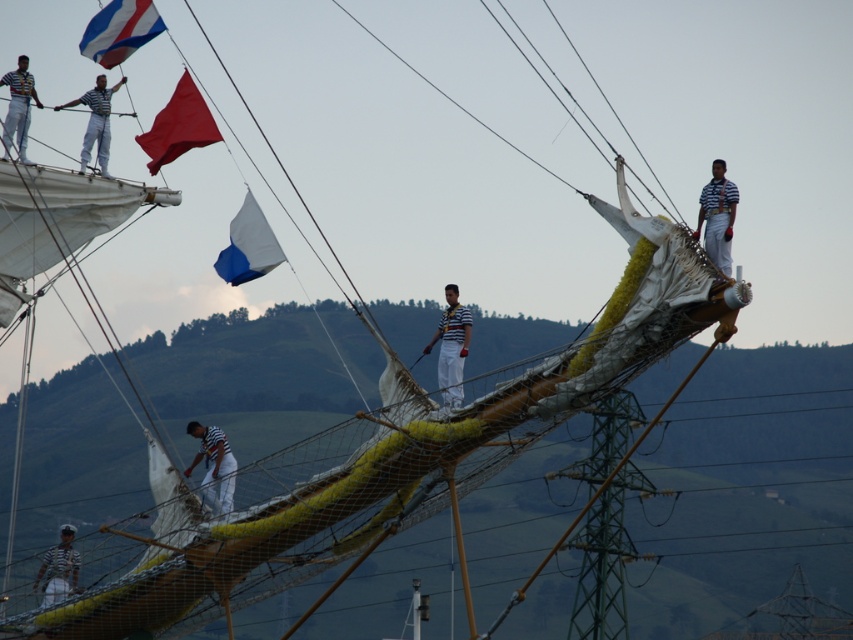
You are a sailor on the ship and need to retrieve the blue matte flag at center. You are currently standing near the white striped shirt at upper right. Can you reach the flag without moving from your current position?

The blue matte flag at center is below the white striped shirt at upper right, so you can reach it without moving from your current position.

You are standing on the deck of the ship and want to take a photo of the point at coordinates point (224, 257). If your camera has a maximum range of 500 feet, will you be able to capture the point in your photo?

The point at coordinates point (224, 257) is 554.37 feet away from the camera, which exceeds the camera maximum range of 500 feet. Therefore, the camera cannot capture the point in the photo.

You are a photographer on the ship and want to take a photo of both the white striped shirt at center and the striped fabric sailor at center. Which one appears larger in the photo?

The white striped shirt at center appears larger in the photo because it is bigger than the striped fabric sailor at center.